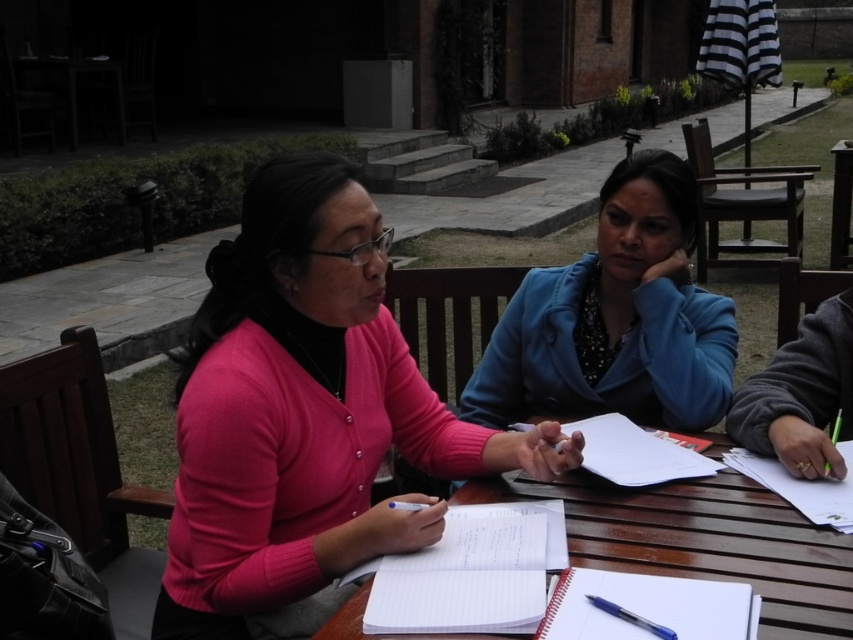
You are a photographer aiming to capture a clear photo of the blue fabric jacket at center and the white paper notebook at center. Since you want both items in focus, which one should you adjust the camera focus on first?

You should focus on the blue fabric jacket at center first because it is closer to the viewer than the white paper notebook at center. By focusing on the closer object, the farther one may still be within the depth of field.

You are standing at the point labeled point (618, 186). You want to walk to the point labeled point (453, 493). Which direction should you move?

You should move forward because point (618, 186) is behind point (453, 493).

You are standing at the point labeled as point (630, 472) and want to move to the point labeled as point (375, 339). Which direction should you move to reach your destination?

You should move towards the direction of point (375, 339) from point (630, 472) because point (375, 339) is behind point (630, 472).